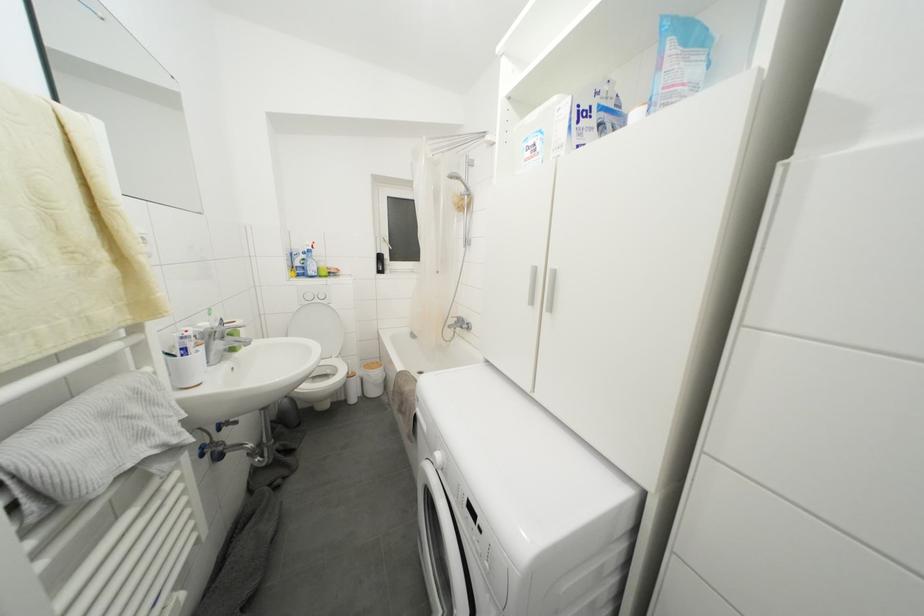
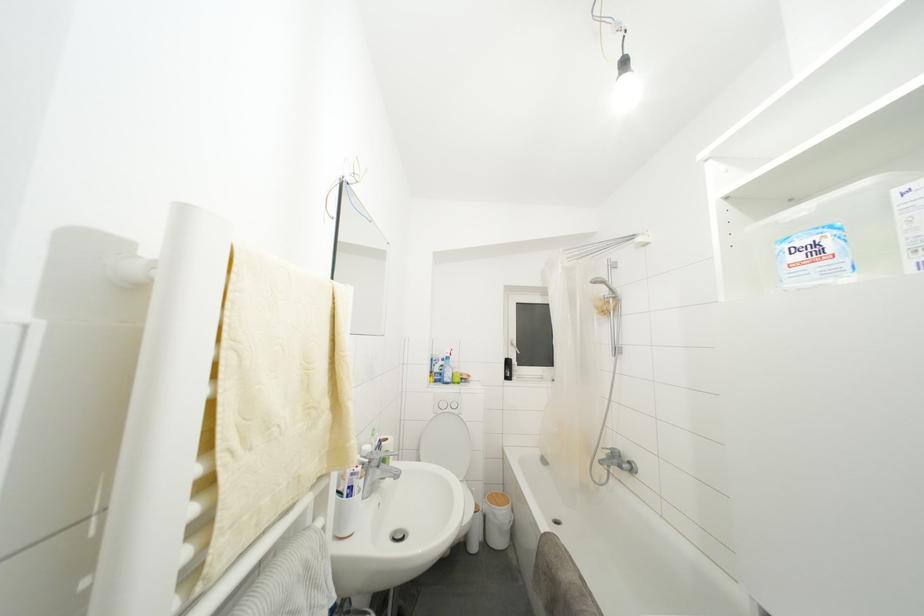
The first image is from the beginning of the video and the second image is from the end. How did the camera likely rotate when shooting the video?

The rotation direction of the camera is left-up.